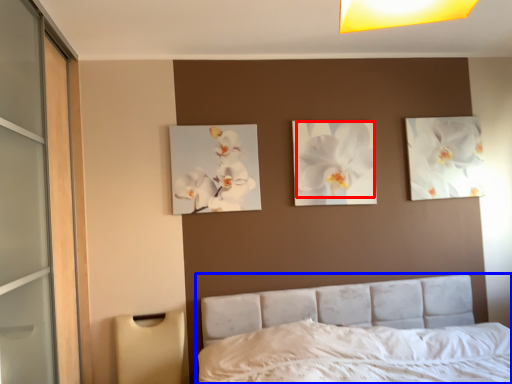
Question: Which object appears closest to the camera in this image, flower (highlighted by a red box) or bed (highlighted by a blue box)?

Choices:
 (A) flower
 (B) bed

Answer: (B)